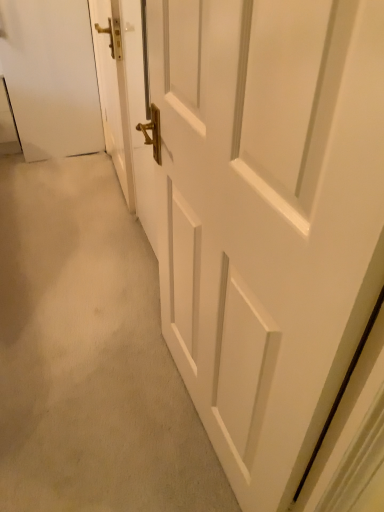
At what (x,y) coordinates should I click in order to perform the action: click on white matte door at center, the first door positioned from the right. Please return your answer as a coordinate pair (x, y). Looking at the image, I should click on coord(267,217).

This screenshot has height=512, width=384. What do you see at coordinates (267, 217) in the screenshot? I see `white matte door at center, the first door positioned from the right` at bounding box center [267, 217].

Describe the element at coordinates (112, 90) in the screenshot. I see `white wooden door at left, which is the 2th door in right-to-left order` at that location.

Identify the location of white wooden door at left, positioned as the 1th door in left-to-right order. (112, 90).

The height and width of the screenshot is (512, 384). I want to click on white matte door at center, the 2th door positioned from the left, so click(x=267, y=217).

Can you confirm if white matte door at center, the 2th door positioned from the left, is positioned to the right of white wooden door at left, which is the 2th door in right-to-left order?

Correct, you'll find white matte door at center, the 2th door positioned from the left, to the right of white wooden door at left, which is the 2th door in right-to-left order.

Is the position of white matte door at center, the 2th door positioned from the left, more distant than that of white wooden door at left, positioned as the 1th door in left-to-right order?

No, white matte door at center, the 2th door positioned from the left, is closer to the viewer.

Between point (208, 249) and point (112, 32), which one is positioned in front?

Positioned in front is point (208, 249).

From the image's perspective, is white matte door at center, the first door positioned from the right, located above or below white wooden door at left, positioned as the 1th door in left-to-right order?

Based on their image positions, white matte door at center, the first door positioned from the right, is located beneath white wooden door at left, positioned as the 1th door in left-to-right order.

From a real-world perspective, between white matte door at center, the first door positioned from the right, and white wooden door at left, positioned as the 1th door in left-to-right order, who is vertically lower?

In real-world perspective, white wooden door at left, positioned as the 1th door in left-to-right order, is lower.

Considering the sizes of white matte door at center, the first door positioned from the right, and white wooden door at left, which is the 2th door in right-to-left order, in the image, is white matte door at center, the first door positioned from the right, wider or thinner than white wooden door at left, which is the 2th door in right-to-left order,?

In the image, white matte door at center, the first door positioned from the right, appears to be wider than white wooden door at left, which is the 2th door in right-to-left order.

Based on the photo, is white matte door at center, the 2th door positioned from the left, shorter than white wooden door at left, positioned as the 1th door in left-to-right order?

Incorrect, the height of white matte door at center, the 2th door positioned from the left, does not fall short of that of white wooden door at left, positioned as the 1th door in left-to-right order.

Considering the relative sizes of white matte door at center, the 2th door positioned from the left, and white wooden door at left, positioned as the 1th door in left-to-right order, in the image provided, is white matte door at center, the 2th door positioned from the left, smaller than white wooden door at left, positioned as the 1th door in left-to-right order,?

No, white matte door at center, the 2th door positioned from the left, is not smaller than white wooden door at left, positioned as the 1th door in left-to-right order.

Is white matte door at center, the first door positioned from the right, spatially inside white wooden door at left, positioned as the 1th door in left-to-right order, or outside of it?

white matte door at center, the first door positioned from the right, is located beyond the bounds of white wooden door at left, positioned as the 1th door in left-to-right order.

Is white matte door at center, the first door positioned from the right, far away from white wooden door at left, which is the 2th door in right-to-left order?

That's right, there is a large distance between white matte door at center, the first door positioned from the right, and white wooden door at left, which is the 2th door in right-to-left order.

Does white matte door at center, the first door positioned from the right, turn towards white wooden door at left, which is the 2th door in right-to-left order?

No, white matte door at center, the first door positioned from the right, is not aimed at white wooden door at left, which is the 2th door in right-to-left order.

How different are the orientations of white matte door at center, the first door positioned from the right, and white wooden door at left, which is the 2th door in right-to-left order, in degrees?

The angle between the facing direction of white matte door at center, the first door positioned from the right, and the facing direction of white wooden door at left, which is the 2th door in right-to-left order, is 1.11 degrees.

Identify the location of door below the white matte door at center, the first door positioned from the right (from a real-world perspective). (112, 90).

Visually, is white wooden door at left, which is the 2th door in right-to-left order, positioned to the left or to the right of white matte door at center, the first door positioned from the right?

Based on their positions, white wooden door at left, which is the 2th door in right-to-left order, is located to the left of white matte door at center, the first door positioned from the right.

Is white wooden door at left, which is the 2th door in right-to-left order, closer to the viewer compared to white matte door at center, the first door positioned from the right?

No, it is behind white matte door at center, the first door positioned from the right.

Which is closer to the camera, (97, 67) or (337, 44)?

Positioned in front is point (337, 44).

From the image's perspective, between white wooden door at left, which is the 2th door in right-to-left order, and white matte door at center, the 2th door positioned from the left, which one is located above?

From the image's view, white wooden door at left, which is the 2th door in right-to-left order, is above.

From a real-world perspective, is white wooden door at left, positioned as the 1th door in left-to-right order, located beneath white matte door at center, the first door positioned from the right?

Yes, from a real-world perspective, white wooden door at left, positioned as the 1th door in left-to-right order, is below white matte door at center, the first door positioned from the right.

Considering the relative sizes of white wooden door at left, positioned as the 1th door in left-to-right order, and white matte door at center, the 2th door positioned from the left, in the image provided, is white wooden door at left, positioned as the 1th door in left-to-right order, wider than white matte door at center, the 2th door positioned from the left,?

No.

Does white wooden door at left, positioned as the 1th door in left-to-right order, have a greater height compared to white matte door at center, the 2th door positioned from the left?

In fact, white wooden door at left, positioned as the 1th door in left-to-right order, may be shorter than white matte door at center, the 2th door positioned from the left.

Is white wooden door at left, positioned as the 1th door in left-to-right order, bigger than white matte door at center, the 2th door positioned from the left?

Actually, white wooden door at left, positioned as the 1th door in left-to-right order, might be smaller than white matte door at center, the 2th door positioned from the left.

Choose the correct answer: Is white wooden door at left, which is the 2th door in right-to-left order, inside white matte door at center, the first door positioned from the right, or outside it?

The correct answer is: outside.

Is there a large distance between white wooden door at left, which is the 2th door in right-to-left order, and white matte door at center, the first door positioned from the right?

white wooden door at left, which is the 2th door in right-to-left order, is positioned a significant distance from white matte door at center, the first door positioned from the right.

Is white wooden door at left, which is the 2th door in right-to-left order, positioned with its back to white matte door at center, the first door positioned from the right?

No.

How many degrees apart are the facing directions of white wooden door at left, positioned as the 1th door in left-to-right order, and white matte door at center, the first door positioned from the right?

1.11 degrees.

In the image, there is a white matte door at center, the first door positioned from the right. Where is `door above it (from the image's perspective)`? This screenshot has height=512, width=384. door above it (from the image's perspective) is located at coordinates (112, 90).

Locate an element on the screen. door that is above the white wooden door at left, positioned as the 1th door in left-to-right order (from a real-world perspective) is located at coordinates (267, 217).

I want to click on door behind the white matte door at center, the 2th door positioned from the left, so click(112, 90).